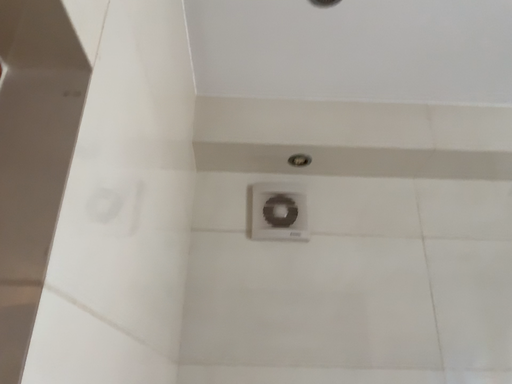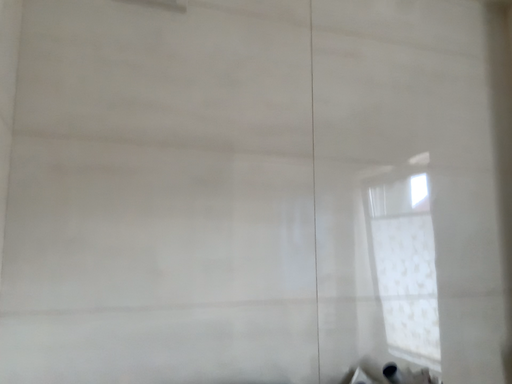
Question: How did the camera likely rotate when shooting the video?

Choices:
 (A) rotated downward
 (B) rotated upward

Answer: (A)